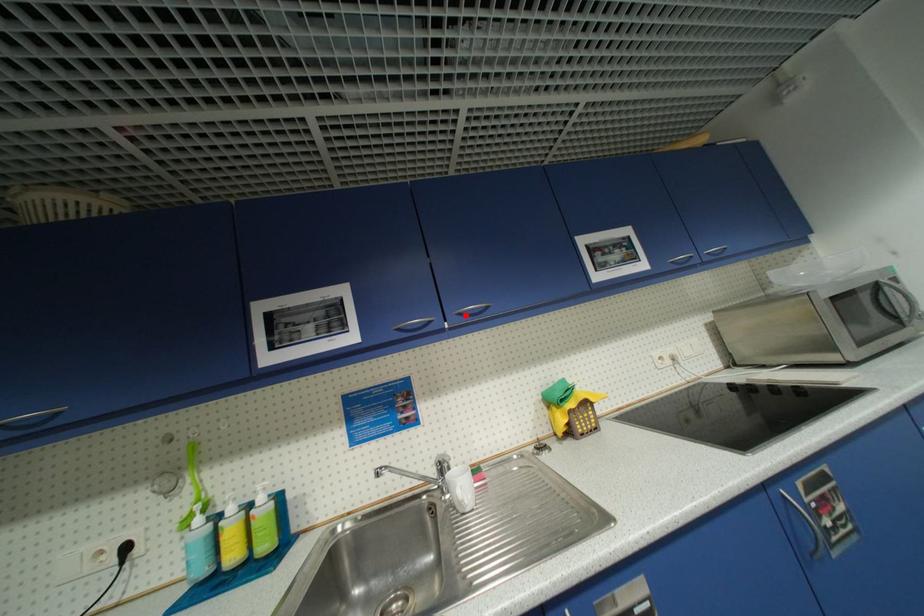
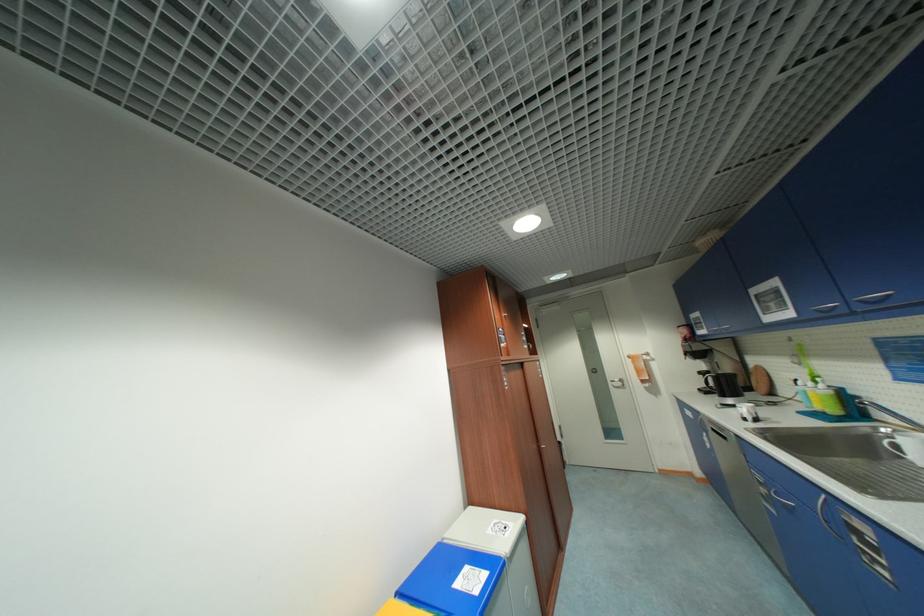
Question: I am providing you with two images of the same scene from different viewpoints. Given a red point in image1, look at the same physical point in image2. Is it:

Choices:
 (A) Closer to the viewpoint
 (B) Farther from the viewpoint

Answer: (A)